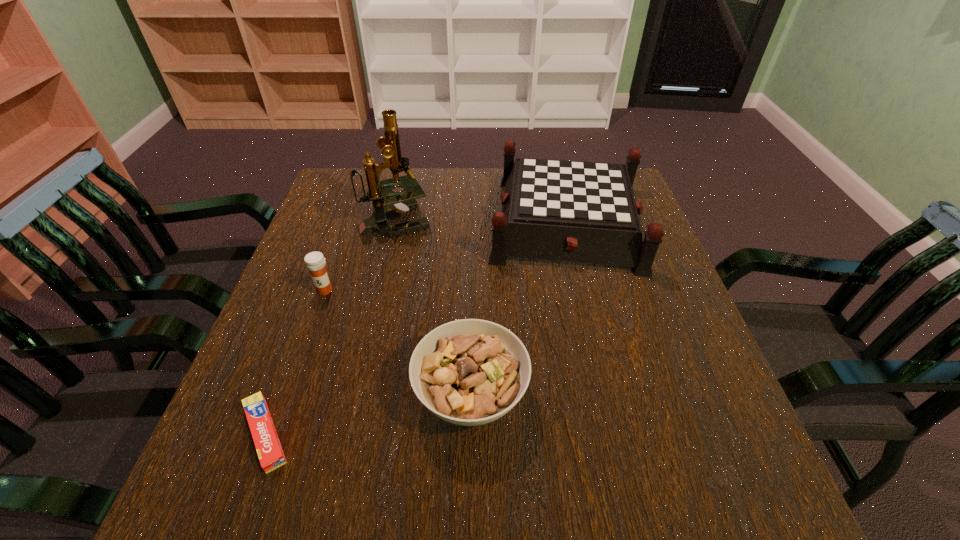
This screenshot has height=540, width=960. I want to click on microscope that is positioned at the far edge, so click(400, 202).

I want to click on checkerboard situated at the far edge, so click(x=573, y=211).

Image resolution: width=960 pixels, height=540 pixels. In order to click on object situated at the near edge in this screenshot , I will do `click(271, 456)`.

Where is `microscope situated at the left edge`? microscope situated at the left edge is located at coordinates (400, 202).

I want to click on medicine that is at the left edge, so click(x=315, y=262).

Locate an element on the screen. toothpaste at the left edge is located at coordinates (271, 456).

Where is `object located in the right edge section of the desktop`? The height and width of the screenshot is (540, 960). object located in the right edge section of the desktop is located at coordinates (573, 211).

Locate an element on the screen. The image size is (960, 540). object present at the far left corner is located at coordinates (400, 202).

Locate an element on the screen. The width and height of the screenshot is (960, 540). object situated at the near left corner is located at coordinates (271, 456).

The width and height of the screenshot is (960, 540). Find the location of `object positioned at the far right corner`. object positioned at the far right corner is located at coordinates (573, 211).